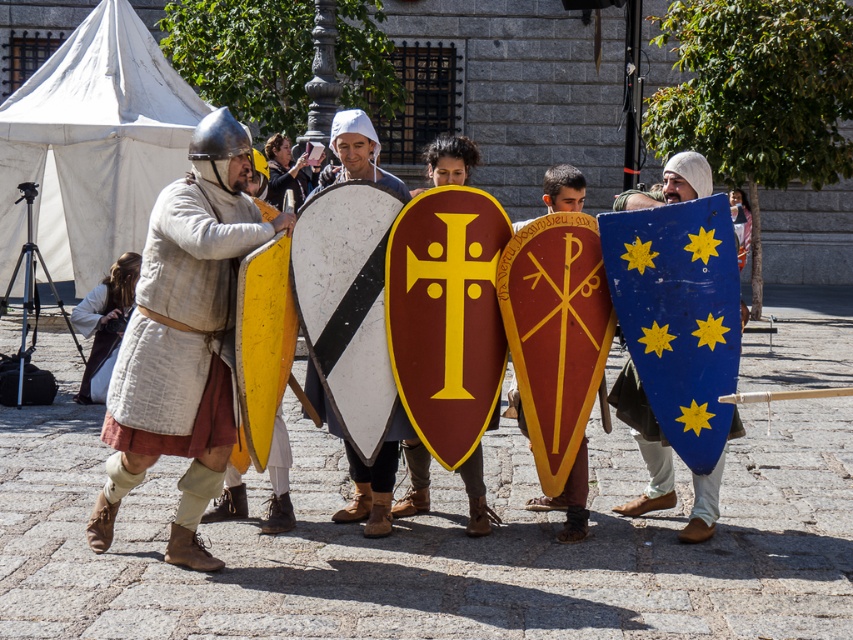
Question: Is white matte shield at center above matte red shield at center?

Choices:
 (A) no
 (B) yes

Answer: (B)

Question: Is blue painted wood shield at center further to the viewer compared to matte gold shield at center?

Choices:
 (A) yes
 (B) no

Answer: (B)

Question: Which object is closer to the camera taking this photo?

Choices:
 (A) white linen robe at left
 (B) matte red shield at center
 (C) matte white shield at center
 (D) matte gold shield at center

Answer: (B)

Question: Considering the relative positions of matte white shield at center and white linen robe at left in the image provided, where is matte white shield at center located with respect to white linen robe at left?

Choices:
 (A) right
 (B) left

Answer: (A)

Question: Which point is farther from the camera taking this photo?

Choices:
 (A) (558, 499)
 (B) (70, 320)
 (C) (697, 476)

Answer: (B)

Question: Among these objects, which one is farthest from the camera?

Choices:
 (A) blue painted wood shield at center
 (B) white matte shield at center

Answer: (A)